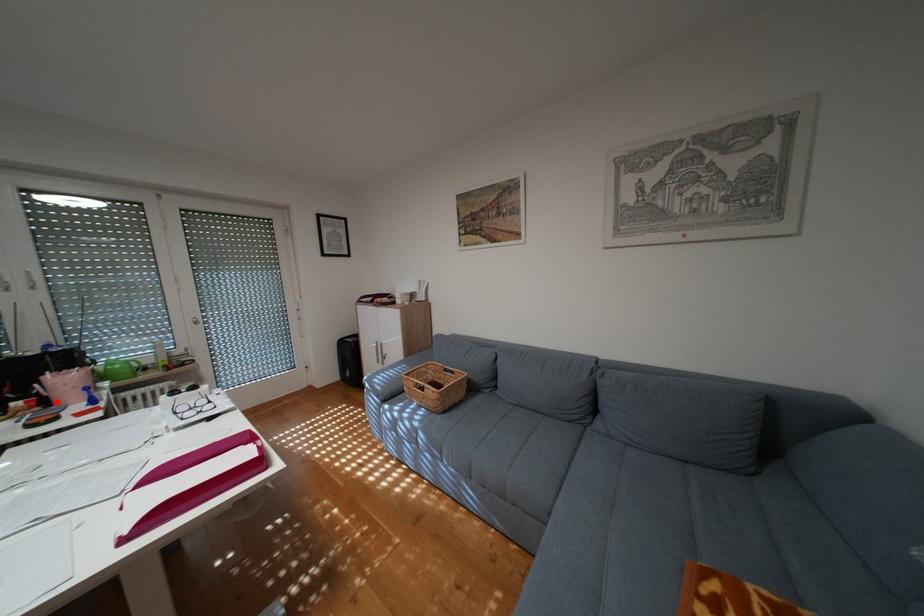
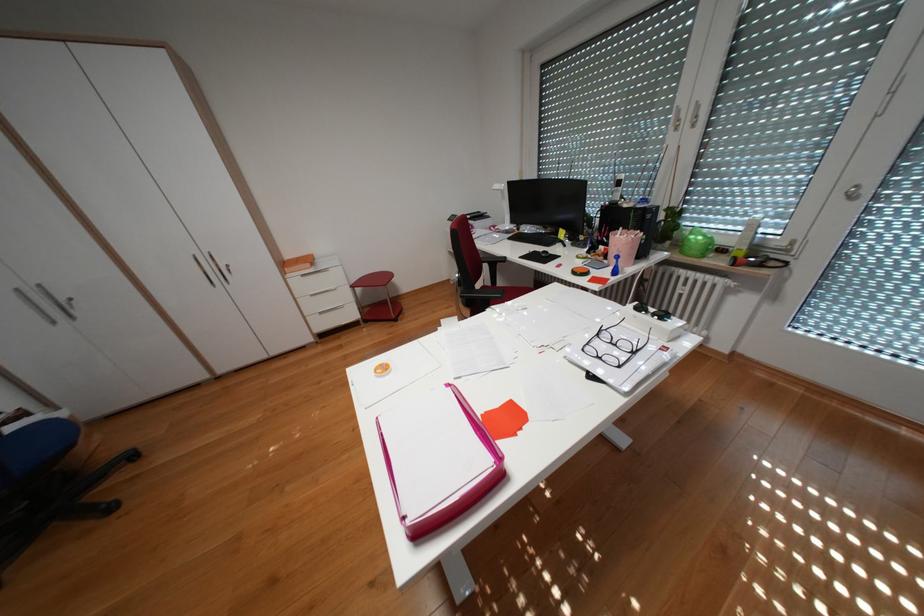
The point at the highlighted location is marked in the first image. Where is the corresponding point in the second image?

(618, 254)